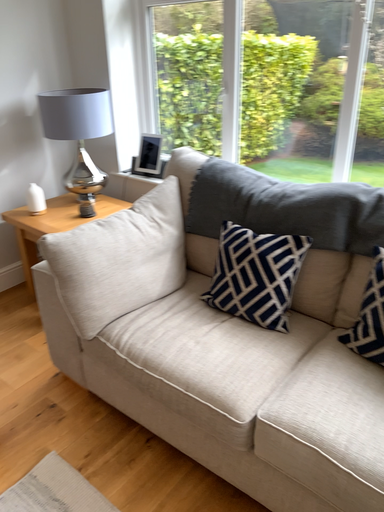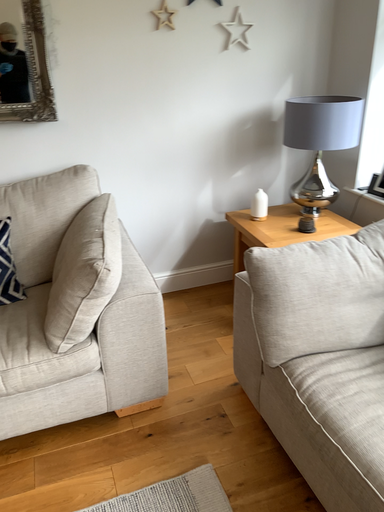
Question: Which way did the camera rotate in the video?

Choices:
 (A) rotated right
 (B) rotated left

Answer: (B)